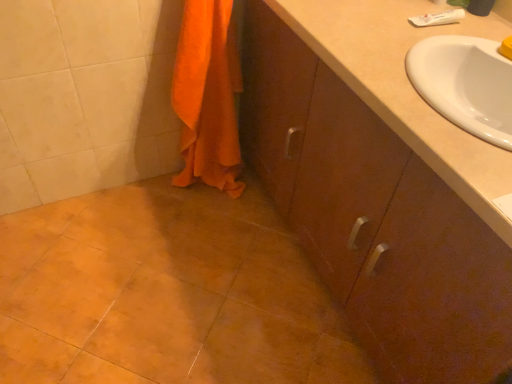
The image size is (512, 384). What are the coordinates of `matte brown cabinet at center` in the screenshot? It's located at (373, 217).

The width and height of the screenshot is (512, 384). Describe the element at coordinates (373, 217) in the screenshot. I see `matte brown cabinet at center` at that location.

Locate an element on the screen. This screenshot has height=384, width=512. orange cotton towel at lower left is located at coordinates tap(208, 96).

What do you see at coordinates (208, 96) in the screenshot?
I see `orange cotton towel at lower left` at bounding box center [208, 96].

Where is `matte brown cabinet at center`? matte brown cabinet at center is located at coordinates (373, 217).

From the picture: Which is more to the left, orange cotton towel at lower left or matte brown cabinet at center?

orange cotton towel at lower left is more to the left.

Is the depth of orange cotton towel at lower left less than that of matte brown cabinet at center?

No, the depth of orange cotton towel at lower left is greater than that of matte brown cabinet at center.

Is point (216, 162) farther from camera compared to point (382, 133)?

Yes, point (216, 162) is farther from viewer.

From the image's perspective, which is below, orange cotton towel at lower left or matte brown cabinet at center?

matte brown cabinet at center.

From a real-world perspective, is orange cotton towel at lower left physically located above or below matte brown cabinet at center?

orange cotton towel at lower left is above matte brown cabinet at center.

Considering the relative sizes of orange cotton towel at lower left and matte brown cabinet at center in the image provided, is orange cotton towel at lower left thinner than matte brown cabinet at center?

Correct, the width of orange cotton towel at lower left is less than that of matte brown cabinet at center.

Between orange cotton towel at lower left and matte brown cabinet at center, which one has less height?

orange cotton towel at lower left.

Which of these two, orange cotton towel at lower left or matte brown cabinet at center, is bigger?

matte brown cabinet at center is bigger.

Is orange cotton towel at lower left positioned beyond the bounds of matte brown cabinet at center?

Yes, orange cotton towel at lower left is outside of matte brown cabinet at center.

Can you see orange cotton towel at lower left touching matte brown cabinet at center?

No, orange cotton towel at lower left is not with matte brown cabinet at center.

Is orange cotton towel at lower left turned away from matte brown cabinet at center?

orange cotton towel at lower left is not turned away from matte brown cabinet at center.

What's the angular difference between orange cotton towel at lower left and matte brown cabinet at center's facing directions?

They differ by 89.5 degrees in their facing directions.

Locate an element on the screen. This screenshot has height=384, width=512. bathroom cabinet on the right of orange cotton towel at lower left is located at coordinates (373, 217).

Based on the photo, is matte brown cabinet at center at the right side of orange cotton towel at lower left?

Correct, you'll find matte brown cabinet at center to the right of orange cotton towel at lower left.

Which object is closer to the camera, matte brown cabinet at center or orange cotton towel at lower left?

matte brown cabinet at center is more forward.

Is point (378, 220) more distant than point (211, 101)?

No, (378, 220) is closer to viewer.

From the image's perspective, is matte brown cabinet at center below orange cotton towel at lower left?

Yes.

From a real-world perspective, is matte brown cabinet at center positioned above or below orange cotton towel at lower left?

matte brown cabinet at center is below orange cotton towel at lower left.

Does matte brown cabinet at center have a lesser width compared to orange cotton towel at lower left?

No, matte brown cabinet at center is not thinner than orange cotton towel at lower left.

Who is taller, matte brown cabinet at center or orange cotton towel at lower left?

With more height is matte brown cabinet at center.

Considering the sizes of matte brown cabinet at center and orange cotton towel at lower left in the image, is matte brown cabinet at center bigger or smaller than orange cotton towel at lower left?

Considering their sizes, matte brown cabinet at center takes up more space than orange cotton towel at lower left.

Is matte brown cabinet at center situated inside orange cotton towel at lower left or outside?

The correct answer is: outside.

Would you consider matte brown cabinet at center to be distant from orange cotton towel at lower left?

That's not correct — matte brown cabinet at center is a little close to orange cotton towel at lower left.

Is matte brown cabinet at center aimed at orange cotton towel at lower left?

Yes.

How many degrees apart are the facing directions of matte brown cabinet at center and orange cotton towel at lower left?

89.5 degrees separate the facing orientations of matte brown cabinet at center and orange cotton towel at lower left.

How far apart are matte brown cabinet at center and orange cotton towel at lower left?

They are 16.47 inches apart.

The height and width of the screenshot is (384, 512). I want to click on bathroom cabinet that is under the orange cotton towel at lower left (from a real-world perspective), so click(x=373, y=217).

The width and height of the screenshot is (512, 384). I want to click on bathroom cabinet below the orange cotton towel at lower left (from a real-world perspective), so click(373, 217).

The width and height of the screenshot is (512, 384). What are the coordinates of `bath towel above the matte brown cabinet at center (from the image's perspective)` in the screenshot? It's located at (208, 96).